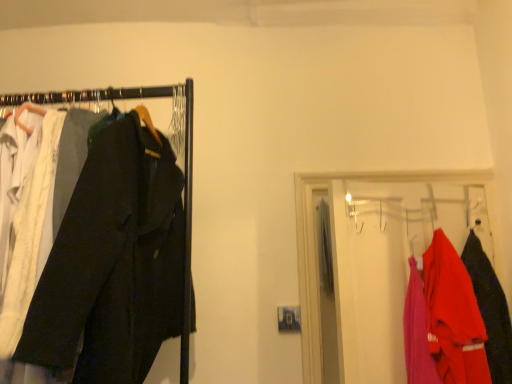
Question: Does matte red jacket at right, placed as the 2th clothing when sorted from right to left, appear on the right side of matte red jacket at right?

Choices:
 (A) no
 (B) yes

Answer: (B)

Question: Is matte red jacket at right, placed as the 2th clothing when sorted from right to left, bigger than matte red jacket at right?

Choices:
 (A) no
 (B) yes

Answer: (A)

Question: From the image's perspective, does matte red jacket at right, placed as the 2th clothing when sorted from right to left, appear lower than matte red jacket at right?

Choices:
 (A) yes
 (B) no

Answer: (A)

Question: Considering the relative sizes of matte red jacket at right, placed as the 2th clothing when sorted from right to left, and matte red jacket at right in the image provided, is matte red jacket at right, placed as the 2th clothing when sorted from right to left, smaller than matte red jacket at right?

Choices:
 (A) no
 (B) yes

Answer: (B)

Question: Is the position of matte red jacket at right, placed as the 2th clothing when sorted from right to left, more distant than that of matte red jacket at right?

Choices:
 (A) yes
 (B) no

Answer: (B)

Question: From their relative heights in the image, would you say matte red jacket at right, the 1th clothing from the left, is taller or shorter than dark gray cotton trousers at left?

Choices:
 (A) short
 (B) tall

Answer: (A)

Question: Is matte red jacket at right, the 1th clothing from the left, bigger or smaller than dark gray cotton trousers at left?

Choices:
 (A) big
 (B) small

Answer: (B)

Question: Considering the positions of point (434, 321) and point (165, 142), is point (434, 321) closer or farther from the camera than point (165, 142)?

Choices:
 (A) closer
 (B) farther

Answer: (A)

Question: From the image's perspective, is matte red jacket at right, placed as the 2th clothing when sorted from right to left, located above or below dark gray cotton trousers at left?

Choices:
 (A) below
 (B) above

Answer: (A)

Question: Is point (463, 193) closer or farther from the camera than point (479, 253)?

Choices:
 (A) farther
 (B) closer

Answer: (A)

Question: Considering the positions of matte red jacket at right and matte red jacket at right, which appears as the 2th clothing when viewed from the left, in the image, is matte red jacket at right bigger or smaller than matte red jacket at right, which appears as the 2th clothing when viewed from the left,?

Choices:
 (A) small
 (B) big

Answer: (B)

Question: From the image's perspective, is matte red jacket at right located above or below matte red jacket at right, which appears as the 2th clothing when viewed from the left?

Choices:
 (A) below
 (B) above

Answer: (B)

Question: Is matte red jacket at right inside or outside of matte red jacket at right, the 1th clothing when ordered from right to left?

Choices:
 (A) outside
 (B) inside

Answer: (A)

Question: From a real-world perspective, is dark gray cotton trousers at left positioned above or below matte red jacket at right, the 1th clothing when ordered from right to left?

Choices:
 (A) above
 (B) below

Answer: (A)

Question: Considering the positions of dark gray cotton trousers at left and matte red jacket at right, which appears as the 2th clothing when viewed from the left, in the image, is dark gray cotton trousers at left wider or thinner than matte red jacket at right, which appears as the 2th clothing when viewed from the left,?

Choices:
 (A) thin
 (B) wide

Answer: (B)